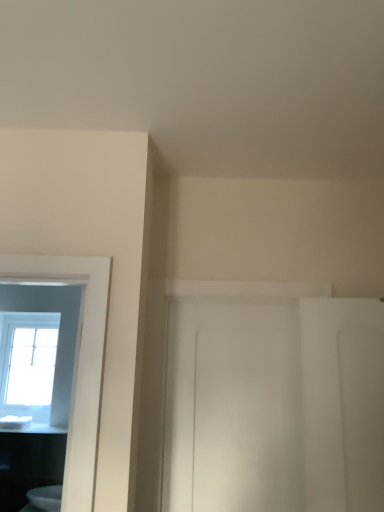
Describe the element at coordinates (34, 428) in the screenshot. I see `white glossy countertop at lower left` at that location.

Identify the location of white glossy countertop at lower left. This screenshot has width=384, height=512. (34, 428).

In order to click on white glossy toilet at lower left in this screenshot , I will do `click(46, 498)`.

Image resolution: width=384 pixels, height=512 pixels. Find the location of `white glossy countertop at lower left`. white glossy countertop at lower left is located at coordinates (34, 428).

From the image's perspective, is white glossy toilet at lower left on top of white glossy countertop at lower left?

No, from the image's perspective, white glossy toilet at lower left is not over white glossy countertop at lower left.

Which is behind, white glossy toilet at lower left or white glossy countertop at lower left?

white glossy countertop at lower left is further from the camera.

Between white glossy toilet at lower left and white glossy countertop at lower left, which one has more height?

Standing taller between the two is white glossy toilet at lower left.

Does white glossy countertop at lower left have a lesser width compared to clear glass window at left?

In fact, white glossy countertop at lower left might be wider than clear glass window at left.

Can you tell me how much white glossy countertop at lower left and clear glass window at left differ in facing direction?

white glossy countertop at lower left and clear glass window at left are facing 0.874 degrees away from each other.

Is point (36, 424) closer to viewer compared to point (18, 402)?

Yes, point (36, 424) is in front of point (18, 402).

Between white glossy countertop at lower left and clear glass window at left, which one appears on the left side from the viewer's perspective?

clear glass window at left is more to the left.

Considering the relative sizes of white glossy countertop at lower left and white glossy toilet at lower left in the image provided, is white glossy countertop at lower left shorter than white glossy toilet at lower left?

Correct, white glossy countertop at lower left is not as tall as white glossy toilet at lower left.

Is white glossy countertop at lower left inside the boundaries of white glossy toilet at lower left, or outside?

white glossy countertop at lower left cannot be found inside white glossy toilet at lower left.

Can you see white glossy countertop at lower left touching white glossy toilet at lower left?

They are not placed beside each other.

Does clear glass window at left have a smaller size compared to white glossy toilet at lower left?

Incorrect, clear glass window at left is not smaller in size than white glossy toilet at lower left.

Does point (28, 396) come behind point (54, 511)?

That is True.

Is clear glass window at left to the left of white glossy toilet at lower left from the viewer's perspective?

Correct, you'll find clear glass window at left to the left of white glossy toilet at lower left.

Is clear glass window at left turned away from white glossy toilet at lower left?

No, clear glass window at left is not facing the opposite direction of white glossy toilet at lower left.

Which of these two, clear glass window at left or white glossy countertop at lower left, is smaller?

white glossy countertop at lower left.

Is point (49, 337) in front of point (18, 426)?

No, (49, 337) is further to viewer.

Which object is more forward, clear glass window at left or white glossy countertop at lower left?

white glossy countertop at lower left is closer to the camera.

Are clear glass window at left and white glossy countertop at lower left far apart?

No.

Is white glossy toilet at lower left spatially inside clear glass window at left, or outside of it?

white glossy toilet at lower left is located beyond the bounds of clear glass window at left.

Is white glossy toilet at lower left oriented away from clear glass window at left?

No, white glossy toilet at lower left's orientation is not away from clear glass window at left.

Does white glossy toilet at lower left have a smaller size compared to clear glass window at left?

Yes.

Locate an element on the screen. This screenshot has width=384, height=512. counter top lying above the white glossy toilet at lower left (from the image's perspective) is located at coordinates (34, 428).

The image size is (384, 512). Find the location of `window behind the white glossy countertop at lower left`. window behind the white glossy countertop at lower left is located at coordinates (29, 359).

Based on their spatial positions, is white glossy toilet at lower left or white glossy countertop at lower left further from clear glass window at left?

The object further to clear glass window at left is white glossy toilet at lower left.

When comparing their distances from clear glass window at left, does white glossy countertop at lower left or white glossy toilet at lower left seem closer?

white glossy countertop at lower left is positioned closer to the anchor clear glass window at left.

Considering their positions, is clear glass window at left positioned further to white glossy toilet at lower left than white glossy countertop at lower left?

The object further to white glossy toilet at lower left is clear glass window at left.

Which object lies nearer to the anchor point white glossy countertop at lower left, white glossy toilet at lower left or clear glass window at left?

white glossy toilet at lower left lies closer to white glossy countertop at lower left than the other object.

Considering their positions, is clear glass window at left positioned closer to white glossy countertop at lower left than white glossy toilet at lower left?

white glossy toilet at lower left lies closer to white glossy countertop at lower left than the other object.

Based on their spatial positions, is white glossy countertop at lower left or clear glass window at left further from white glossy toilet at lower left?

clear glass window at left is positioned further to the anchor white glossy toilet at lower left.

Where is `counter top between white glossy toilet at lower left and clear glass window at left along the z-axis`? The image size is (384, 512). counter top between white glossy toilet at lower left and clear glass window at left along the z-axis is located at coordinates (34, 428).